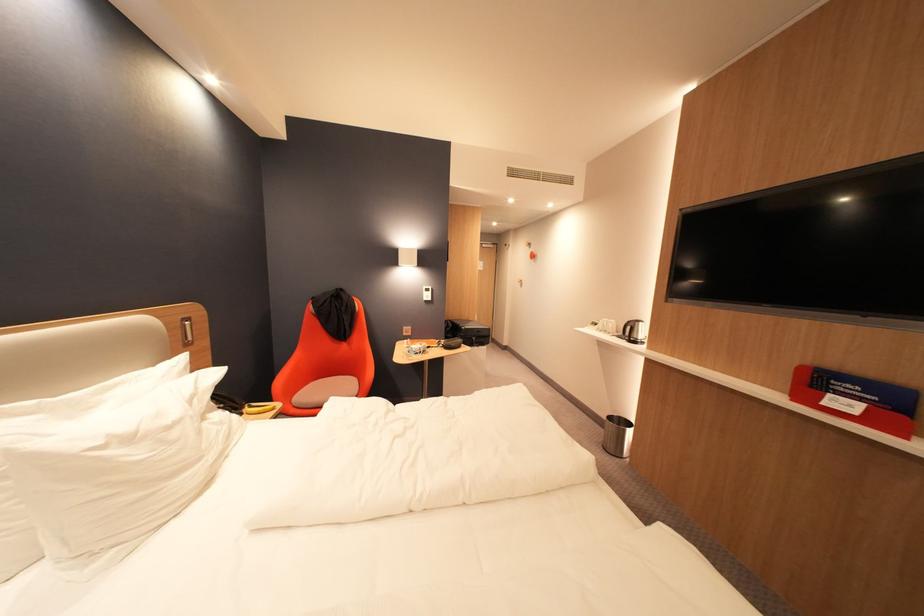
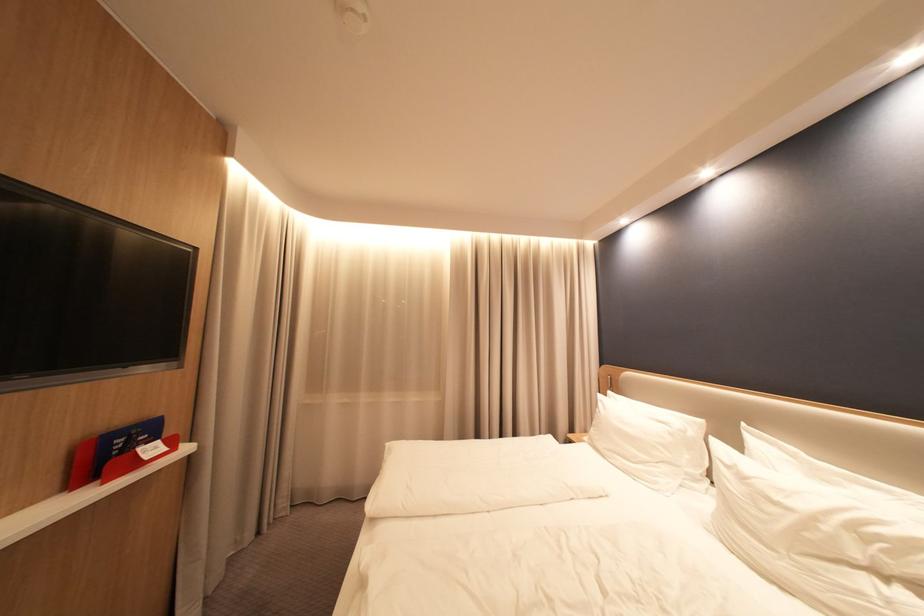
The point at (841, 395) is marked in the first image. Where is the corresponding point in the second image?

(150, 452)